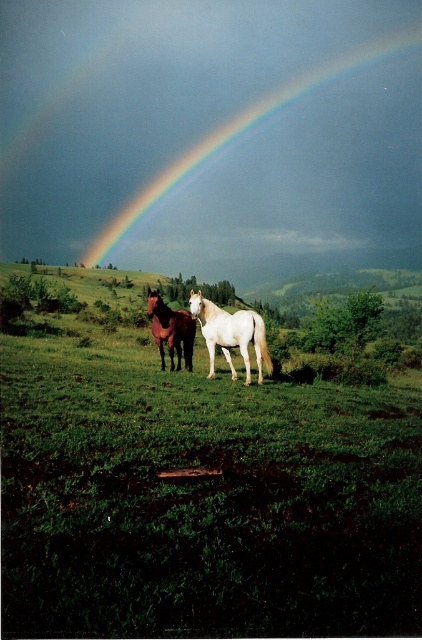
Is rainbow at upper center taller than brown glossy horse at center?

Yes.

Does point (113, 218) come closer to viewer compared to point (156, 291)?

No, (113, 218) is further to viewer.

This screenshot has height=640, width=422. What are the coordinates of `rainbow at upper center` in the screenshot? It's located at (243, 131).

Does green grassy field at center have a greater height compared to white glossy horse at center?

No.

In the scene shown: Measure the distance from green grassy field at center to white glossy horse at center.

They are 5.04 meters apart.

Image resolution: width=422 pixels, height=640 pixels. Find the location of `green grassy field at center`. green grassy field at center is located at coordinates (197, 490).

Locate an element on the screen. green grassy field at center is located at coordinates (197, 490).

Is white glossy horse at center bigger than brown glossy horse at center?

Actually, white glossy horse at center might be smaller than brown glossy horse at center.

Is point (232, 326) less distant than point (159, 342)?

Yes.

At what (x,y) coordinates should I click in order to perform the action: click on white glossy horse at center. Please return your answer as a coordinate pair (x, y). This screenshot has width=422, height=640. Looking at the image, I should click on (230, 333).